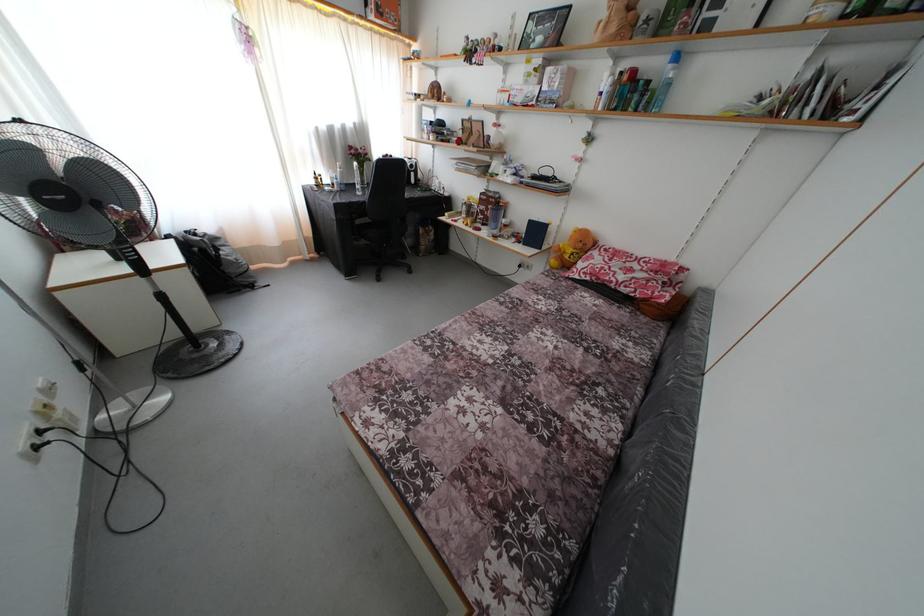
Locate an element on the screen. Image resolution: width=924 pixels, height=616 pixels. black chair armrest is located at coordinates (350, 207).